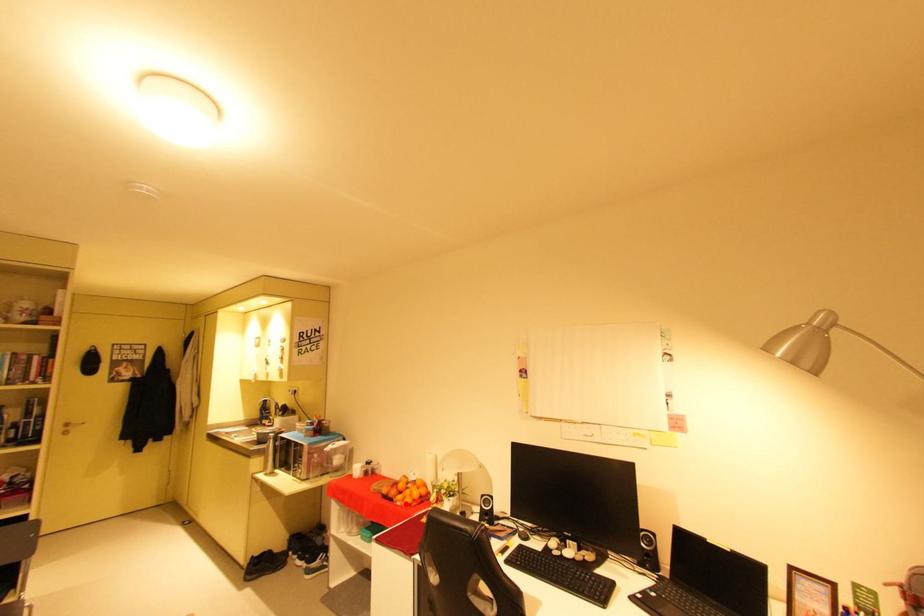
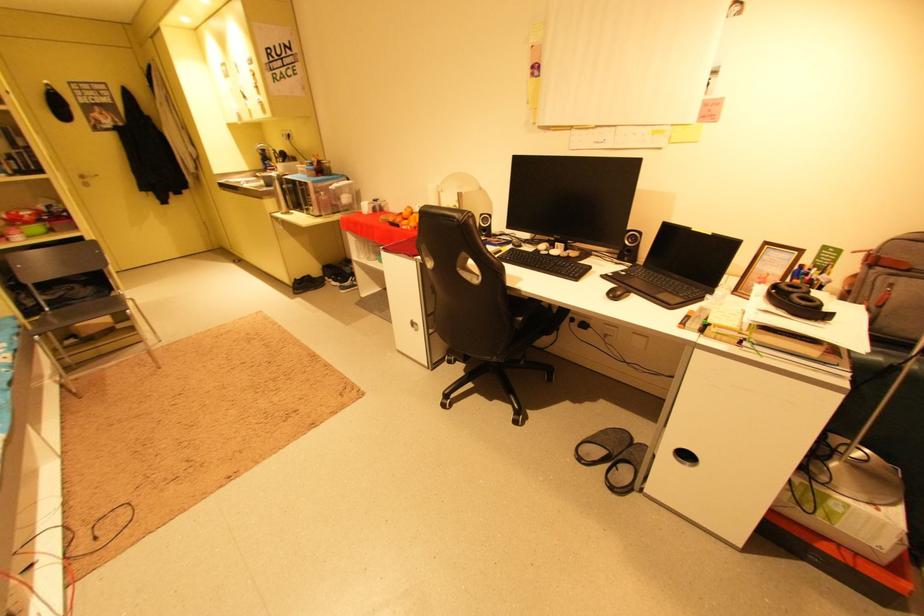
Where in the second image is the point corresponding to the highlighted location from the first image?

(410, 228)